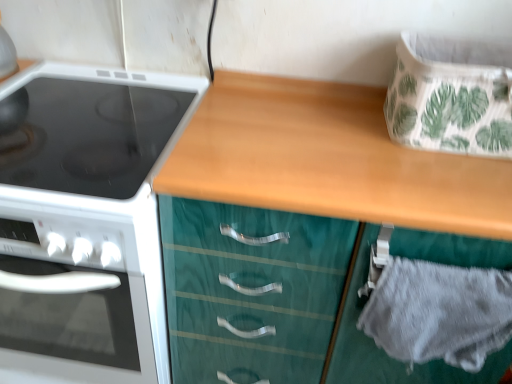
Question: In terms of width, does white glossy electric stove at left look wider or thinner when compared to gray fabric drawer at lower right, the 1th cabinetry from the back?

Choices:
 (A) wide
 (B) thin

Answer: (A)

Question: From a real-world perspective, relative to gray fabric drawer at lower right, which ranks as the 2th cabinetry in front-to-back order, is white glossy electric stove at left vertically above or below?

Choices:
 (A) below
 (B) above

Answer: (A)

Question: Which object is positioned farthest from the teal wood cabinet at center, placed as the 2th cabinetry when sorted from back to front?

Choices:
 (A) gray fabric drawer at lower right, which ranks as the 2th cabinetry in front-to-back order
 (B) white glossy electric stove at left

Answer: (B)

Question: Estimate the real-world distances between objects in this image. Which object is closer to the teal wood cabinet at center, the 1th cabinetry in the front-to-back sequence?

Choices:
 (A) gray fabric drawer at lower right, the 1th cabinetry from the back
 (B) white glossy electric stove at left

Answer: (A)